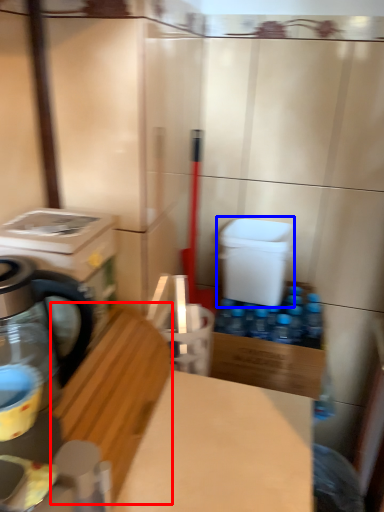
Question: Which object appears farthest to the camera in this image, wood (highlighted by a red box) or water cooler (highlighted by a blue box)?

Choices:
 (A) wood
 (B) water cooler

Answer: (B)